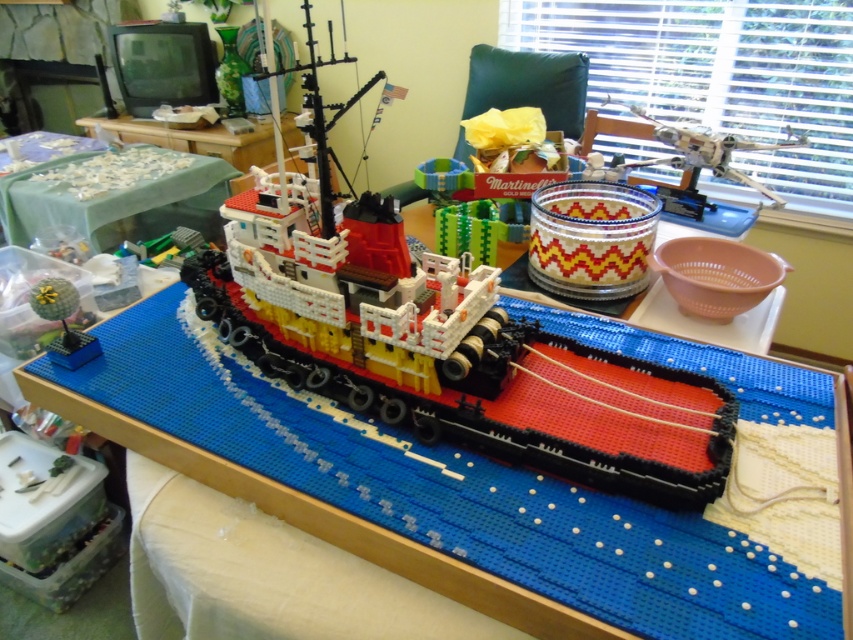
Between brick-like lego ship at center and green fabric table at upper left, which one appears on the left side from the viewer's perspective?

green fabric table at upper left

Between point (367, 314) and point (86, 157), which one is positioned in front?

Point (367, 314) is in front.

I want to click on brick-like lego ship at center, so pos(486,385).

Can you confirm if beaded glass jar at center is shorter than green matte plant at lower left?

No, beaded glass jar at center is not shorter than green matte plant at lower left.

Does beaded glass jar at center have a greater height compared to green matte plant at lower left?

Yes.

Who is more distant from viewer, [555,228] or [78,353]?

Positioned behind is point [555,228].

I want to click on beaded glass jar at center, so click(x=590, y=237).

Which is above, brick-like lego ship at center or green matte plant at lower left?

brick-like lego ship at center is higher up.

The image size is (853, 640). Describe the element at coordinates (486, 385) in the screenshot. I see `brick-like lego ship at center` at that location.

Identify the location of brick-like lego ship at center. (486, 385).